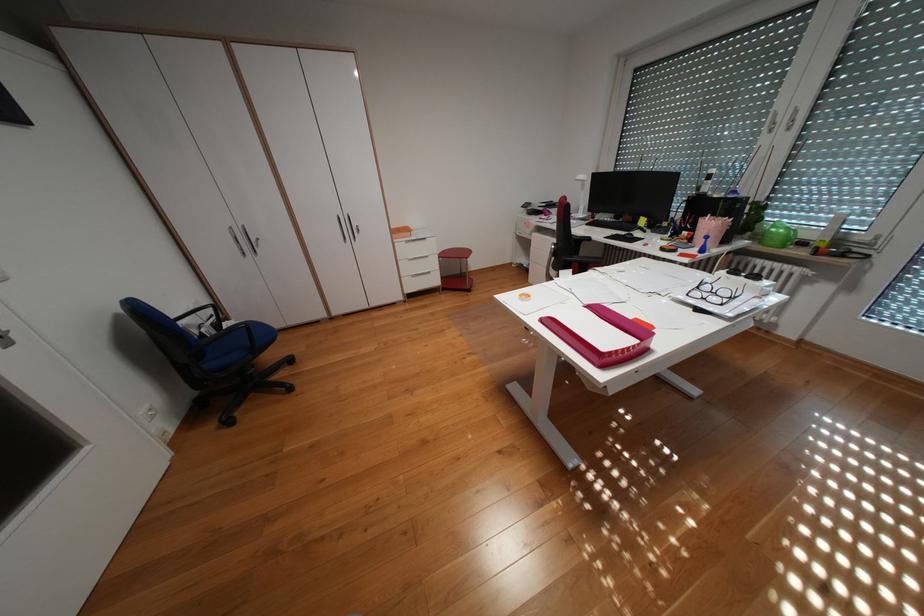
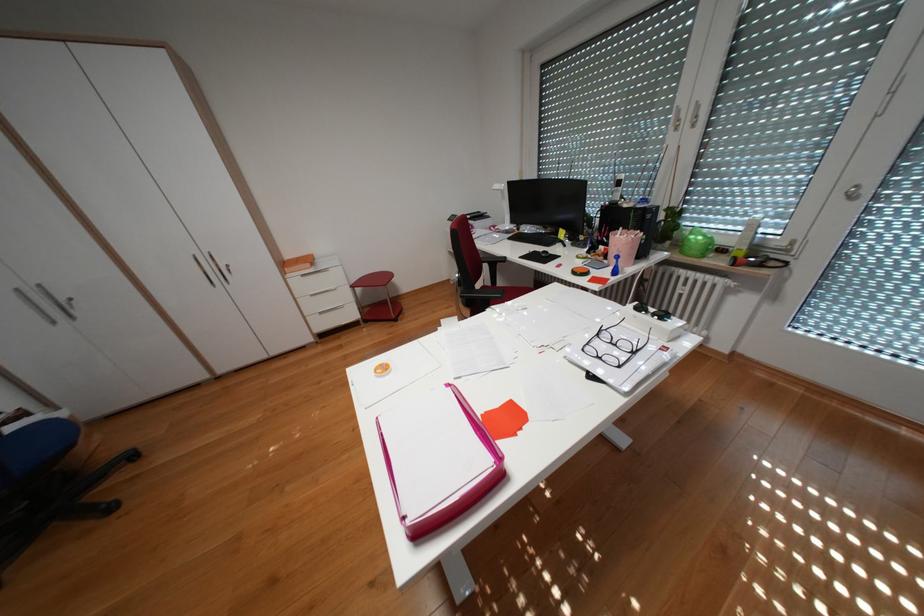
The point at (628, 235) is marked in the first image. Where is the corresponding point in the second image?

(546, 252)